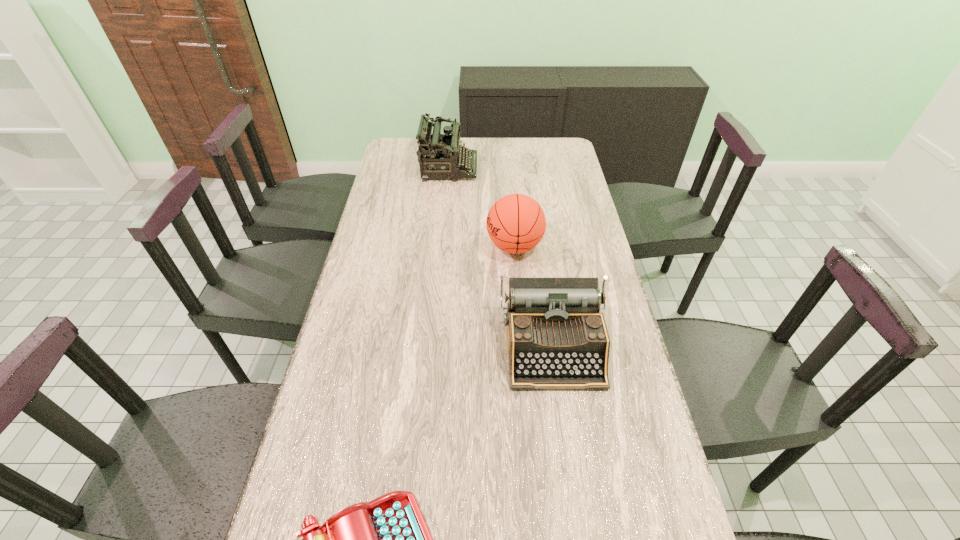
Where is `the farthest typewriter`? The image size is (960, 540). the farthest typewriter is located at coordinates (444, 154).

Locate an element on the screen. Image resolution: width=960 pixels, height=540 pixels. the farthest object is located at coordinates (444, 154).

Image resolution: width=960 pixels, height=540 pixels. I want to click on basketball, so [x=516, y=223].

The width and height of the screenshot is (960, 540). In order to click on the third farthest object in this screenshot , I will do `click(557, 338)`.

The image size is (960, 540). I want to click on the rightmost typewriter, so click(x=557, y=338).

I want to click on vacant area situated on the keyboard of the tallest typewriter, so click(540, 168).

The height and width of the screenshot is (540, 960). What are the coordinates of `vacant space situated on the side with logo of the basketball` in the screenshot? It's located at (391, 246).

Where is `free space located on the side with logo of the basketball`? The height and width of the screenshot is (540, 960). free space located on the side with logo of the basketball is located at coordinates (414, 246).

This screenshot has width=960, height=540. Identify the location of free space located 0.380m on the side with logo of the basketball. (376, 246).

This screenshot has width=960, height=540. I want to click on free space located on the keyboard of the second nearest object, so click(569, 457).